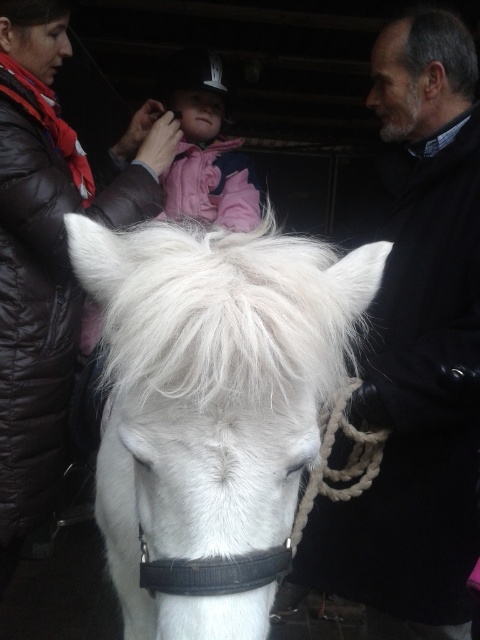
Question: Where is dark gray wool coat at right located in relation to brown leather jacket at left in the image?

Choices:
 (A) right
 (B) left

Answer: (A)

Question: Does dark gray wool coat at right have a lesser width compared to brown leather jacket at left?

Choices:
 (A) no
 (B) yes

Answer: (A)

Question: Is white fluffy horse at center thinner than pink fleece jacket at center?

Choices:
 (A) no
 (B) yes

Answer: (A)

Question: Which object is positioned farthest from the dark gray wool coat at right?

Choices:
 (A) white fluffy horse at center
 (B) brown leather jacket at left
 (C) pink fleece jacket at center

Answer: (B)

Question: Which object is positioned farthest from the brown leather jacket at left?

Choices:
 (A) pink fleece jacket at center
 (B) white fluffy horse at center
 (C) dark gray wool coat at right

Answer: (C)

Question: Which of the following is the farthest from the observer?

Choices:
 (A) (361, 419)
 (B) (46, 422)
 (C) (252, 193)
 (D) (179, 541)

Answer: (C)